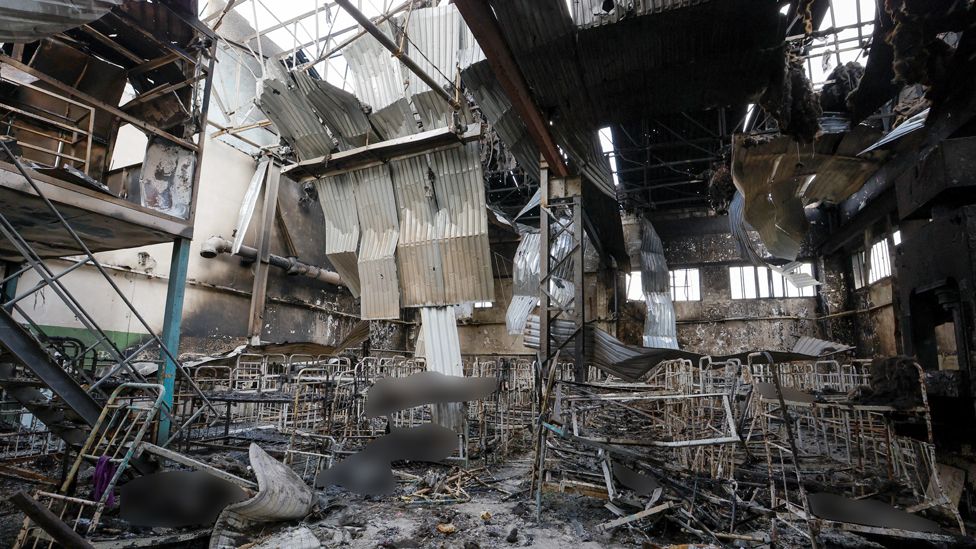
Where is `pipe along wall`? This screenshot has width=976, height=549. pipe along wall is located at coordinates (873, 302), (764, 318), (200, 285), (289, 259).